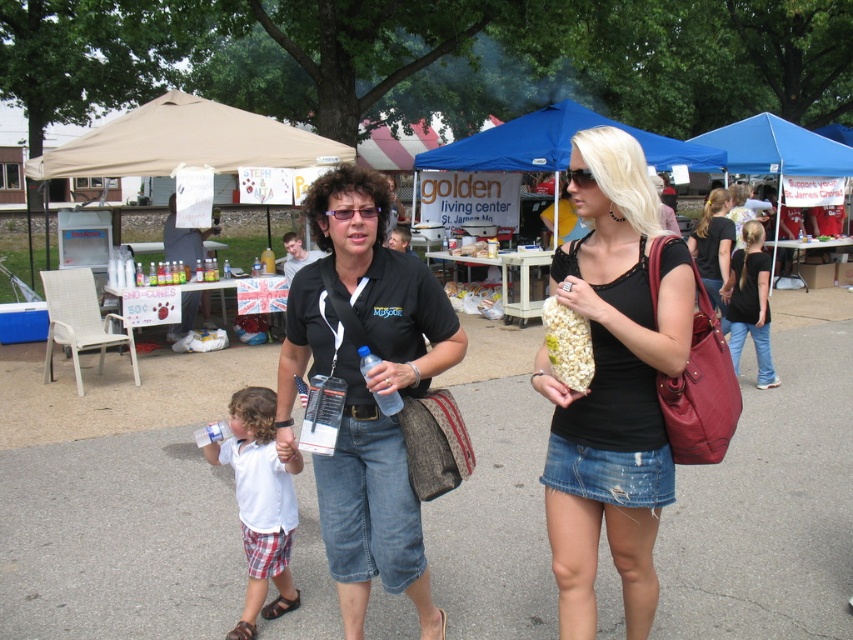
You are at the fair and want to buy a snack. You see a black cotton shirt at right and white popcorn at center. Which object is taller?

The black cotton shirt at right is taller than the white popcorn at center.

You are at the community fair and want to buy some popcorn. You see the white popcorn at center and the beige fabric tent at upper left. Which direction should you walk to reach the popcorn stand first?

The beige fabric tent at upper left is 7.35 meters away from the white popcorn at center. Since you want to reach the popcorn stand first, you should walk toward the white popcorn at center directly, as it is closer than the beige fabric tent at upper left.

You are standing at the golden living center tent and want to take a photo of both the point at coordinates (x=277, y=424) and the point at coordinates (x=721, y=218). Which point will appear larger in your photo?

Point at coordinates (x=277, y=424) will appear larger in the photo because it is closer to the camera than point at coordinates (x=721, y=218).